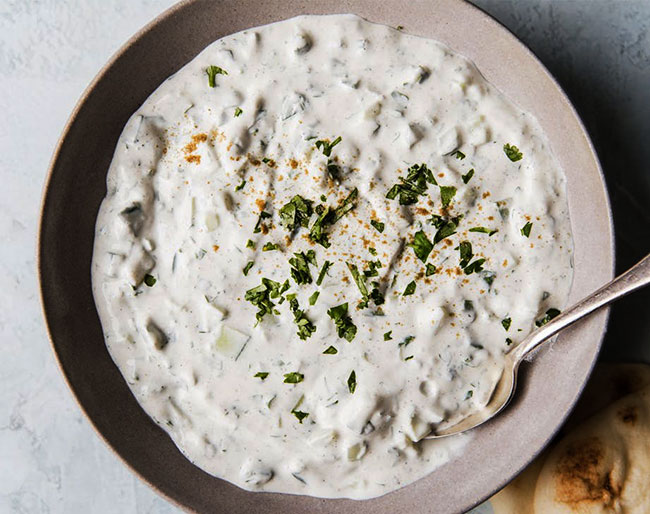
This screenshot has width=650, height=514. Identify the location of white marble pattern on surface. (49, 53), (29, 426).